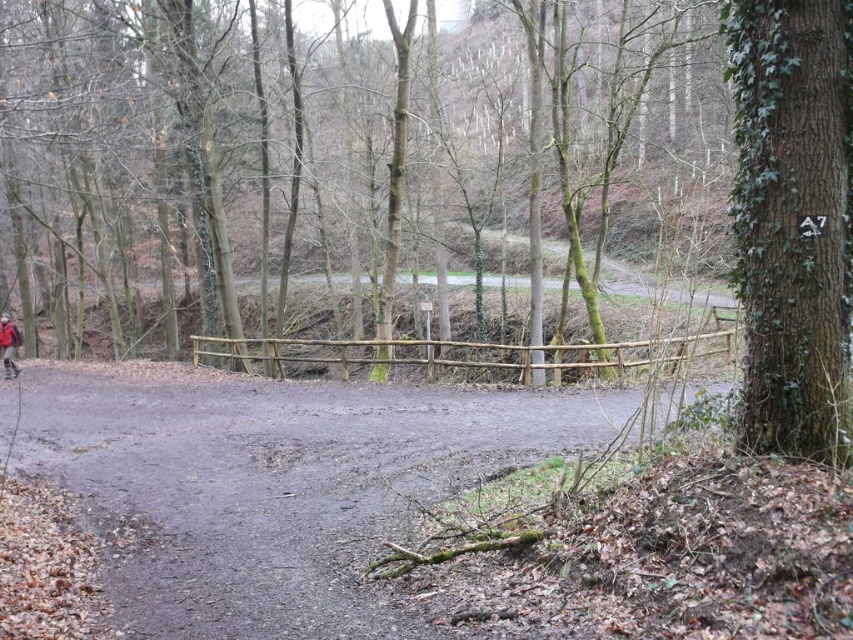
Is green ivy-covered tree at right positioned behind red jacket at left?

That is False.

Does green ivy-covered tree at right have a larger size compared to red jacket at left?

Incorrect, green ivy-covered tree at right is not larger than red jacket at left.

Is point (749, 317) less distant than point (19, 369)?

That is True.

This screenshot has height=640, width=853. I want to click on green ivy-covered tree at right, so click(x=793, y=220).

Does green mossy tree at center have a lesser height compared to green ivy-covered tree at right?

In fact, green mossy tree at center may be taller than green ivy-covered tree at right.

Can you confirm if green mossy tree at center is taller than green ivy-covered tree at right?

Indeed, green mossy tree at center has a greater height compared to green ivy-covered tree at right.

This screenshot has width=853, height=640. Identify the location of green mossy tree at center. (345, 172).

The height and width of the screenshot is (640, 853). What are the coordinates of `green mossy tree at center` in the screenshot? It's located at (x=345, y=172).

Is dull gray dirt track at center taller than red jacket at left?

Correct, dull gray dirt track at center is much taller as red jacket at left.

This screenshot has width=853, height=640. I want to click on dull gray dirt track at center, so click(270, 484).